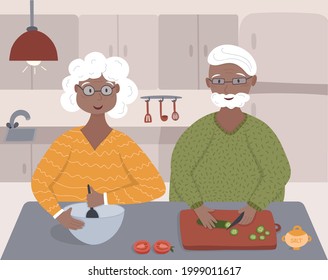
The height and width of the screenshot is (280, 328). I want to click on refrigerators, so click(296, 92).